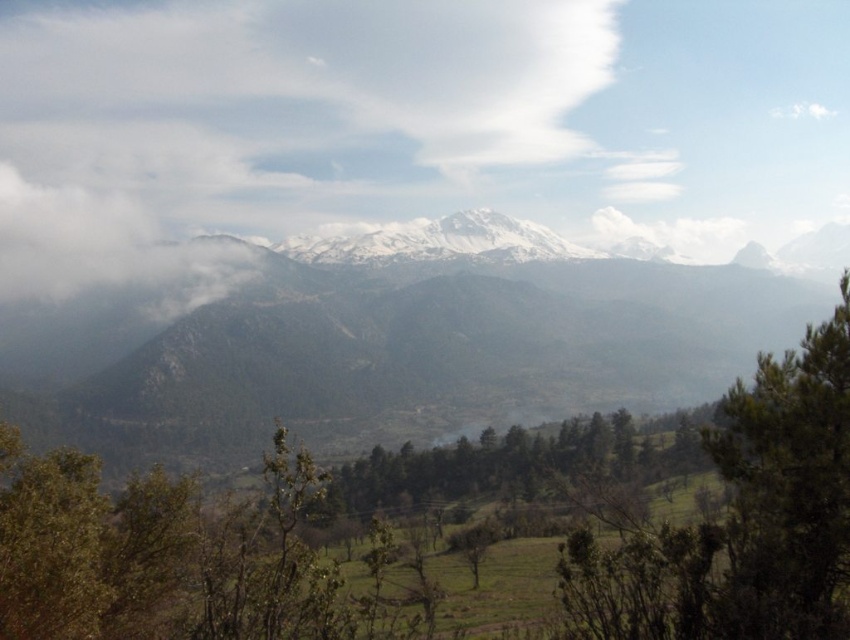
You are a photographer standing at the base of the mountain, aiming to capture the snow peak in the background and the white fluffy cloud at upper center. Given that the camera can focus up to 2000 feet, will the cloud be in focus if you focus on the snow peak?

The white fluffy cloud at upper center is 1538.17 feet away from the camera. Since the camera can focus up to 2000 feet, focusing on the snow peak will also keep the cloud in focus as it is within the camera range.